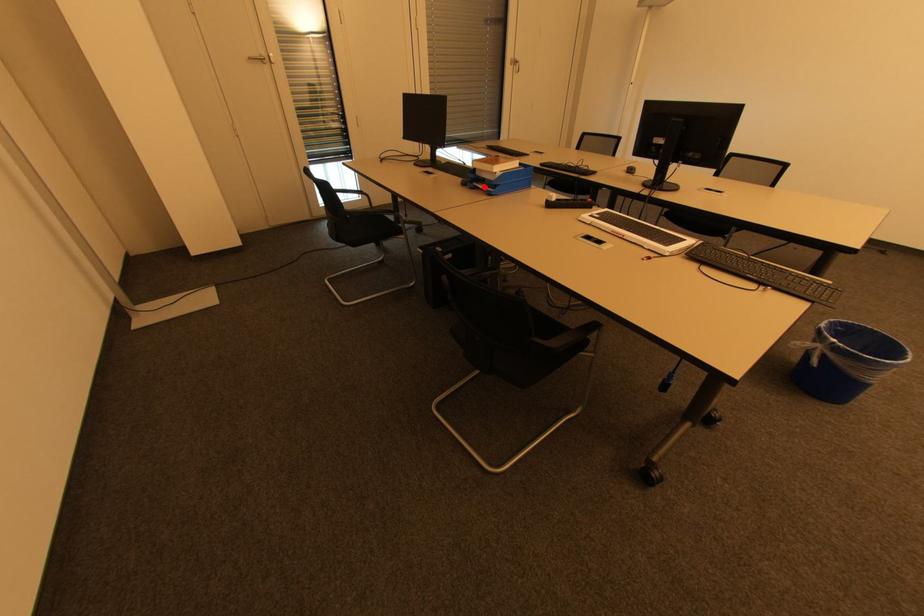
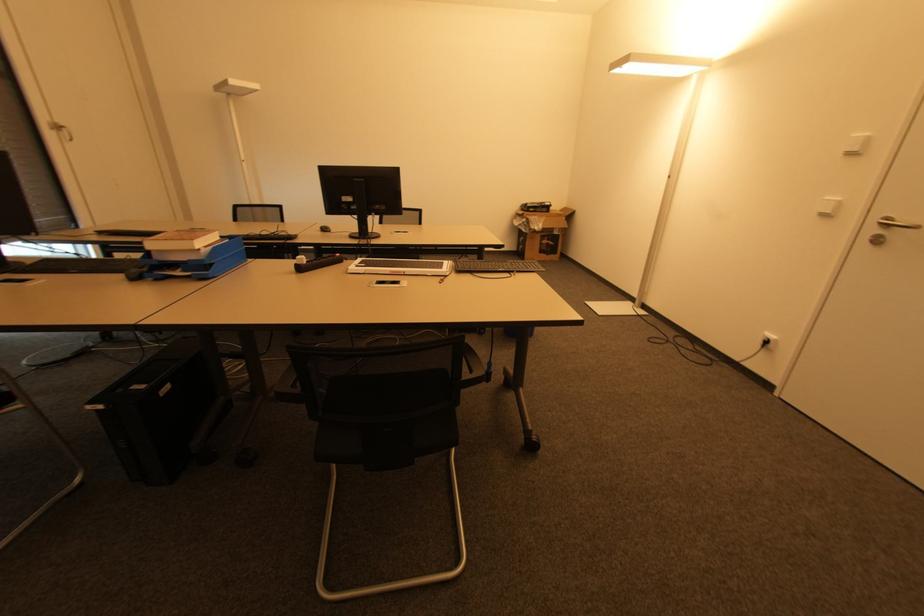
The point at the highlighted location is marked in the first image. Where is the corresponding point in the second image?

(178, 274)